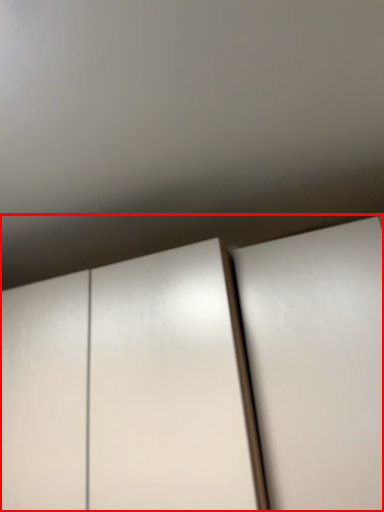
Question: Observing the image, what is the correct spatial positioning of cupboard (annotated by the red box) in reference to door?

Choices:
 (A) left
 (B) right

Answer: (A)